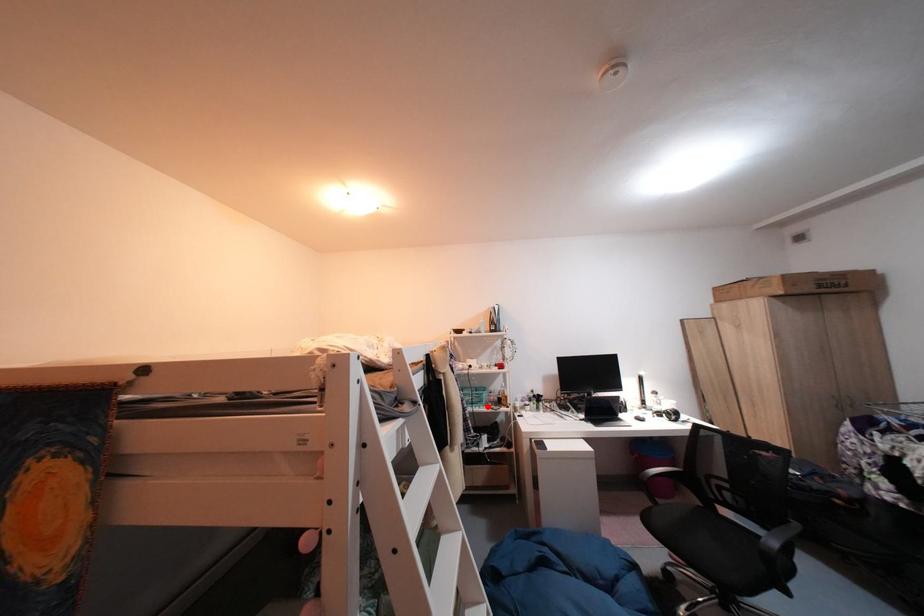
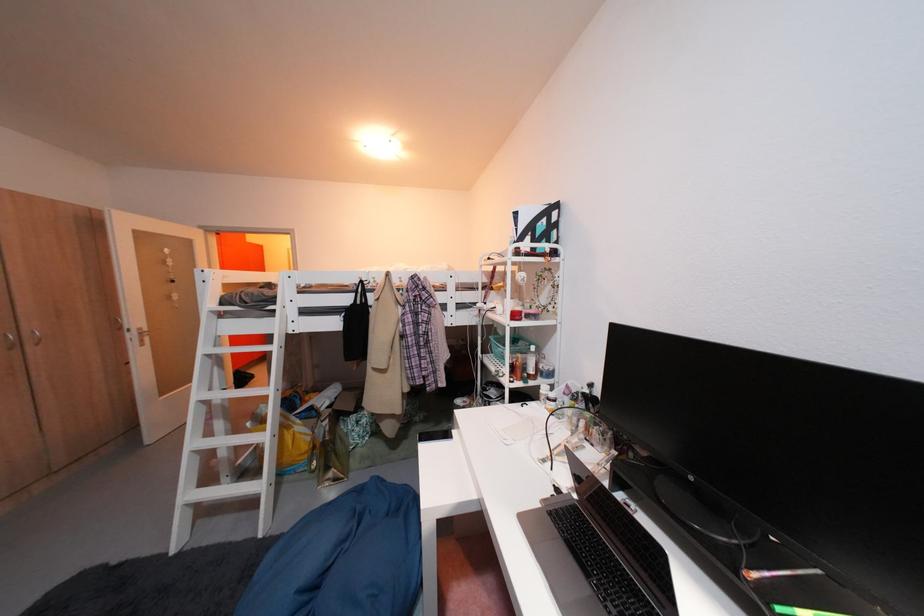
The point at the highlighted location is marked in the first image. Where is the corresponding point in the second image?

(514, 363)